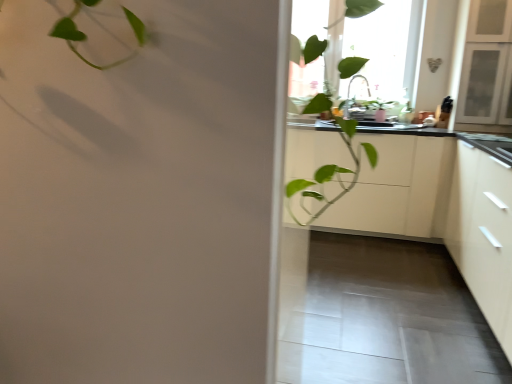
What is the approximate width of white matte cabinet at right, the second cabinetry viewed from the back?

It is 26.01 inches.

The height and width of the screenshot is (384, 512). I want to click on black matte countertop at center, so click(x=439, y=209).

This screenshot has width=512, height=384. In order to click on white matte cabinet at center, the first cabinetry in the back-to-front sequence in this screenshot , I will do `click(398, 188)`.

How much space does white matte cabinet at center, the first cabinetry in the back-to-front sequence, occupy horizontally?

It is 25.48 inches.

What are the coordinates of `transparent glass window at upper center` in the screenshot? It's located at (370, 41).

You are a GUI agent. You are given a task and a screenshot of the screen. Output one action in this format:
    pyautogui.click(x=<x>, y=<y>)
    Task: Click on the white matte cabinet at right, the 1th cabinetry in the front-to-back sequence
    
    Given the screenshot: What is the action you would take?
    pyautogui.click(x=483, y=234)

From the image's perspective, which is below, white matte cabinet at right, the 1th cabinetry in the front-to-back sequence, or transparent glass window at upper center?

From the image's view, white matte cabinet at right, the 1th cabinetry in the front-to-back sequence, is below.

Are white matte cabinet at right, the second cabinetry viewed from the back, and transparent glass window at upper center far apart?

Yes, white matte cabinet at right, the second cabinetry viewed from the back, and transparent glass window at upper center are quite far apart.

Would you say transparent glass window at upper center is part of white matte cabinet at right, the second cabinetry viewed from the back,'s contents?

No, transparent glass window at upper center is not surrounded by white matte cabinet at right, the second cabinetry viewed from the back.

Could you measure the distance between white matte cabinet at right, the 1th cabinetry in the front-to-back sequence, and transparent glass window at upper center?

white matte cabinet at right, the 1th cabinetry in the front-to-back sequence, and transparent glass window at upper center are 1.80 meters apart from each other.

Which is behind, black matte countertop at center or transparent glass window at upper center?

transparent glass window at upper center is behind.

Is black matte countertop at center inside the boundaries of transparent glass window at upper center, or outside?

black matte countertop at center is spatially situated outside transparent glass window at upper center.

Which point is more forward, (337, 183) or (409, 23)?

The point (337, 183) is in front.

From the image's perspective, is black matte countertop at center on top of transparent glass window at upper center?

No, from the image's perspective, black matte countertop at center is not on top of transparent glass window at upper center.

Are white matte cabinet at right, the second cabinetry viewed from the back, and black matte countertop at center far apart?

No, white matte cabinet at right, the second cabinetry viewed from the back, is not far from black matte countertop at center.

Who is taller, white matte cabinet at right, the 1th cabinetry in the front-to-back sequence, or black matte countertop at center?

white matte cabinet at right, the 1th cabinetry in the front-to-back sequence.

Considering the relative positions of white matte cabinet at right, the 1th cabinetry in the front-to-back sequence, and black matte countertop at center in the image provided, is white matte cabinet at right, the 1th cabinetry in the front-to-back sequence, to the left or to the right of black matte countertop at center?

white matte cabinet at right, the 1th cabinetry in the front-to-back sequence, is to the right of black matte countertop at center.

Which point is more distant from viewer, (497, 199) or (490, 255)?

The point (490, 255) is more distant.

Does transparent glass window at upper center contain black matte countertop at center?

No, black matte countertop at center is located outside of transparent glass window at upper center.

Can you tell me how much transparent glass window at upper center and black matte countertop at center differ in facing direction?

There is a 89.8-degree angle between the facing directions of transparent glass window at upper center and black matte countertop at center.

Is there a large distance between transparent glass window at upper center and black matte countertop at center?

transparent glass window at upper center is far away from black matte countertop at center.

Which is more to the right, white matte cabinet at right, the 1th cabinetry in the front-to-back sequence, or white matte cabinet at center, the 2th cabinetry when ordered from front to back?

white matte cabinet at right, the 1th cabinetry in the front-to-back sequence.

From a real-world perspective, is white matte cabinet at right, the second cabinetry viewed from the back, located higher than white matte cabinet at center, the first cabinetry in the back-to-front sequence?

Yes.

From the image's perspective, relative to white matte cabinet at center, the 2th cabinetry when ordered from front to back, is white matte cabinet at right, the 1th cabinetry in the front-to-back sequence, above or below?

white matte cabinet at right, the 1th cabinetry in the front-to-back sequence, is situated lower than white matte cabinet at center, the 2th cabinetry when ordered from front to back, in the image.

Could white matte cabinet at center, the first cabinetry in the back-to-front sequence, be considered to be inside white matte cabinet at right, the 1th cabinetry in the front-to-back sequence?

No, white matte cabinet at center, the first cabinetry in the back-to-front sequence, is not inside white matte cabinet at right, the 1th cabinetry in the front-to-back sequence.

Considering the positions of points (361, 167) and (494, 210), is point (361, 167) farther from camera compared to point (494, 210)?

That is True.

Based on their sizes in the image, would you say black matte countertop at center is bigger or smaller than white matte cabinet at right, the second cabinetry viewed from the back?

In the image, black matte countertop at center appears to be larger than white matte cabinet at right, the second cabinetry viewed from the back.

From the image's perspective, is black matte countertop at center under white matte cabinet at right, the second cabinetry viewed from the back?

Yes, from the image's perspective, black matte countertop at center is beneath white matte cabinet at right, the second cabinetry viewed from the back.

Is black matte countertop at center outside of white matte cabinet at right, the 1th cabinetry in the front-to-back sequence?

black matte countertop at center is positioned outside white matte cabinet at right, the 1th cabinetry in the front-to-back sequence.

Is transparent glass window at upper center located outside white matte cabinet at center, the 2th cabinetry when ordered from front to back?

Indeed, transparent glass window at upper center is completely outside white matte cabinet at center, the 2th cabinetry when ordered from front to back.

In the scene shown: What's the angular difference between transparent glass window at upper center and white matte cabinet at center, the 2th cabinetry when ordered from front to back,'s facing directions?

The angle between the facing direction of transparent glass window at upper center and the facing direction of white matte cabinet at center, the 2th cabinetry when ordered from front to back, is 0.224 degrees.

Considering the sizes of objects transparent glass window at upper center and white matte cabinet at center, the 2th cabinetry when ordered from front to back, in the image provided, who is shorter, transparent glass window at upper center or white matte cabinet at center, the 2th cabinetry when ordered from front to back,?

Standing shorter between the two is white matte cabinet at center, the 2th cabinetry when ordered from front to back.

You are a GUI agent. You are given a task and a screenshot of the screen. Output one action in this format:
    pyautogui.click(x=<x>, y=<y>)
    Task: Click on the cabinetry that is the 2nd object located in front of the transparent glass window at upper center
    
    Given the screenshot: What is the action you would take?
    pyautogui.click(x=483, y=234)

In the image, there is a black matte countertop at center. At what (x,y) coordinates should I click in order to perform the action: click on window above it (from the image's perspective). Please return your answer as a coordinate pair (x, y). The width and height of the screenshot is (512, 384). Looking at the image, I should click on (370, 41).

Estimate the real-world distances between objects in this image. Which object is closer to black matte countertop at center, transparent glass window at upper center or white matte cabinet at center, the 2th cabinetry when ordered from front to back?

The object closer to black matte countertop at center is white matte cabinet at center, the 2th cabinetry when ordered from front to back.

Looking at this image, based on their spatial positions, is white matte cabinet at right, the 1th cabinetry in the front-to-back sequence, or white matte cabinet at center, the 2th cabinetry when ordered from front to back, further from black matte countertop at center?

white matte cabinet at center, the 2th cabinetry when ordered from front to back.

When comparing their distances from white matte cabinet at center, the first cabinetry in the back-to-front sequence, does transparent glass window at upper center or white matte cabinet at right, the second cabinetry viewed from the back, seem closer?

The object closer to white matte cabinet at center, the first cabinetry in the back-to-front sequence, is white matte cabinet at right, the second cabinetry viewed from the back.

When comparing their distances from white matte cabinet at center, the 2th cabinetry when ordered from front to back, does black matte countertop at center or white matte cabinet at right, the 1th cabinetry in the front-to-back sequence, seem further?

white matte cabinet at right, the 1th cabinetry in the front-to-back sequence, is further to white matte cabinet at center, the 2th cabinetry when ordered from front to back.

Looking at the image, which one is located closer to transparent glass window at upper center, black matte countertop at center or white matte cabinet at right, the 1th cabinetry in the front-to-back sequence?

The object closer to transparent glass window at upper center is black matte countertop at center.

Estimate the real-world distances between objects in this image. Which object is further from white matte cabinet at right, the 1th cabinetry in the front-to-back sequence, transparent glass window at upper center or black matte countertop at center?

transparent glass window at upper center lies further to white matte cabinet at right, the 1th cabinetry in the front-to-back sequence, than the other object.

Estimate the real-world distances between objects in this image. Which object is further from transparent glass window at upper center, white matte cabinet at right, the second cabinetry viewed from the back, or white matte cabinet at center, the 2th cabinetry when ordered from front to back?

white matte cabinet at right, the second cabinetry viewed from the back.

Estimate the real-world distances between objects in this image. Which object is closer to white matte cabinet at right, the second cabinetry viewed from the back, black matte countertop at center or transparent glass window at upper center?

Based on the image, black matte countertop at center appears to be nearer to white matte cabinet at right, the second cabinetry viewed from the back.

The height and width of the screenshot is (384, 512). In order to click on cabinetry located between white matte cabinet at right, the 1th cabinetry in the front-to-back sequence, and transparent glass window at upper center in the depth direction in this screenshot , I will do (x=398, y=188).

At what (x,y) coordinates should I click in order to perform the action: click on cabinetry between black matte countertop at center and white matte cabinet at center, the 2th cabinetry when ordered from front to back, from front to back. Please return your answer as a coordinate pair (x, y). This screenshot has height=384, width=512. Looking at the image, I should click on (483, 234).